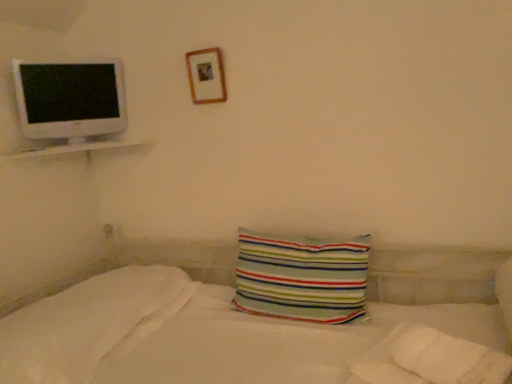
Question: Which direction should I rotate to look at striped fabric pillow at center, placed as the first pillow when sorted from right to left, — up or down?

Choices:
 (A) down
 (B) up

Answer: (A)

Question: Should I look upward or downward to see white glossy shelf at upper left?

Choices:
 (A) up
 (B) down

Answer: (A)

Question: Does wooden picture frame at upper center have a greater height compared to white soft pillow at lower left, the 2th pillow viewed from the right?

Choices:
 (A) no
 (B) yes

Answer: (B)

Question: Does wooden picture frame at upper center appear on the left side of white soft pillow at lower left, which is the 1th pillow from left to right?

Choices:
 (A) yes
 (B) no

Answer: (B)

Question: From the image's perspective, would you say wooden picture frame at upper center is shown under white soft pillow at lower left, the 2th pillow viewed from the right?

Choices:
 (A) yes
 (B) no

Answer: (B)

Question: Can you confirm if wooden picture frame at upper center is positioned to the right of white soft pillow at lower left, the 2th pillow viewed from the right?

Choices:
 (A) no
 (B) yes

Answer: (B)

Question: Can you see wooden picture frame at upper center touching white soft pillow at lower left, the 2th pillow viewed from the right?

Choices:
 (A) yes
 (B) no

Answer: (B)

Question: From a real-world perspective, is wooden picture frame at upper center on top of white soft pillow at lower left, which is the 1th pillow from left to right?

Choices:
 (A) no
 (B) yes

Answer: (B)

Question: Is white glossy computer monitor at upper left not near white glossy shelf at upper left?

Choices:
 (A) yes
 (B) no

Answer: (B)

Question: Is white glossy computer monitor at upper left smaller than white glossy shelf at upper left?

Choices:
 (A) no
 (B) yes

Answer: (A)

Question: Is white glossy computer monitor at upper left thinner than white glossy shelf at upper left?

Choices:
 (A) yes
 (B) no

Answer: (A)

Question: Does white glossy computer monitor at upper left lie in front of white glossy shelf at upper left?

Choices:
 (A) no
 (B) yes

Answer: (A)

Question: Is white glossy computer monitor at upper left facing towards white glossy shelf at upper left?

Choices:
 (A) no
 (B) yes

Answer: (A)

Question: From a real-world perspective, is white glossy computer monitor at upper left positioned over white glossy shelf at upper left based on gravity?

Choices:
 (A) no
 (B) yes

Answer: (B)

Question: Is white glossy shelf at upper left touching wooden picture frame at upper center?

Choices:
 (A) yes
 (B) no

Answer: (B)